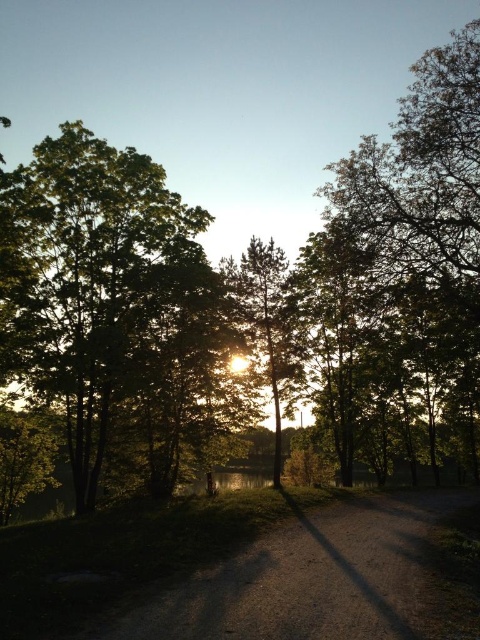
Question: Which point is farther to the camera?

Choices:
 (A) dirt/gravel path at center
 (B) silhouette textured tree at center

Answer: (B)

Question: Does dirt/gravel path at center appear on the left side of silhouette textured tree at center?

Choices:
 (A) no
 (B) yes

Answer: (A)

Question: Which of the following is the closest to the observer?

Choices:
 (A) tap(288, 620)
 (B) tap(228, 275)

Answer: (A)

Question: Can you confirm if dirt/gravel path at center is bigger than silhouette textured tree at center?

Choices:
 (A) no
 (B) yes

Answer: (A)

Question: From the image, what is the correct spatial relationship of dirt/gravel path at center in relation to silhouette textured tree at center?

Choices:
 (A) left
 (B) right

Answer: (B)